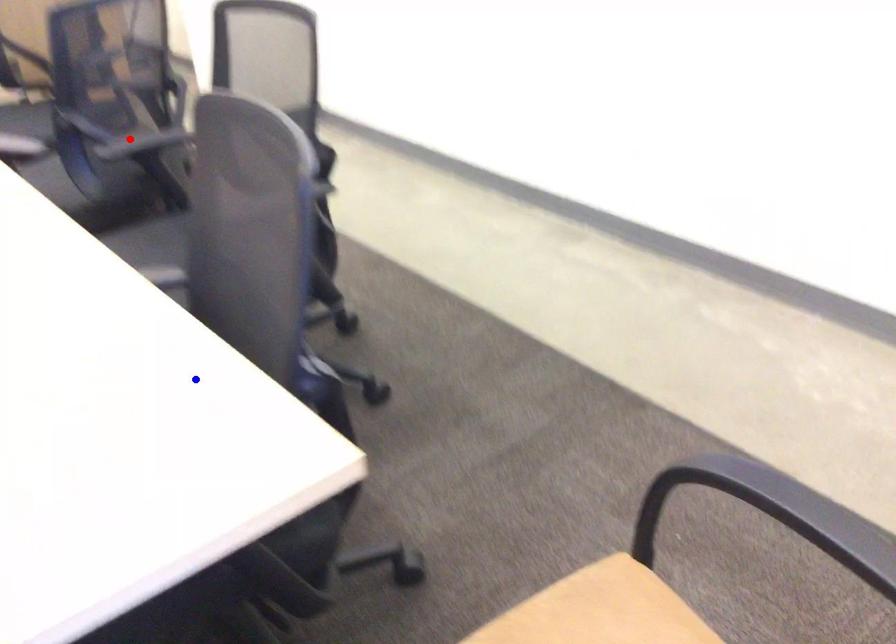
Question: In the image, two points are highlighted. Which point is nearer to the camera? Reply with the corresponding letter.

Choices:
 (A) blue point
 (B) red point

Answer: (A)